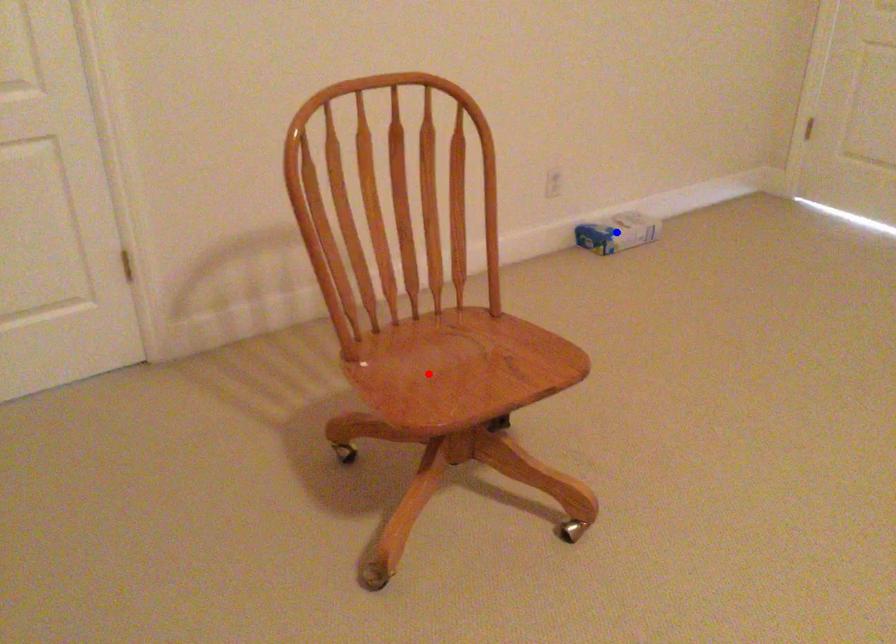
Question: Two points are marked on the image. Which point is closer to the camera?

Choices:
 (A) Blue point is closer.
 (B) Red point is closer.

Answer: (B)